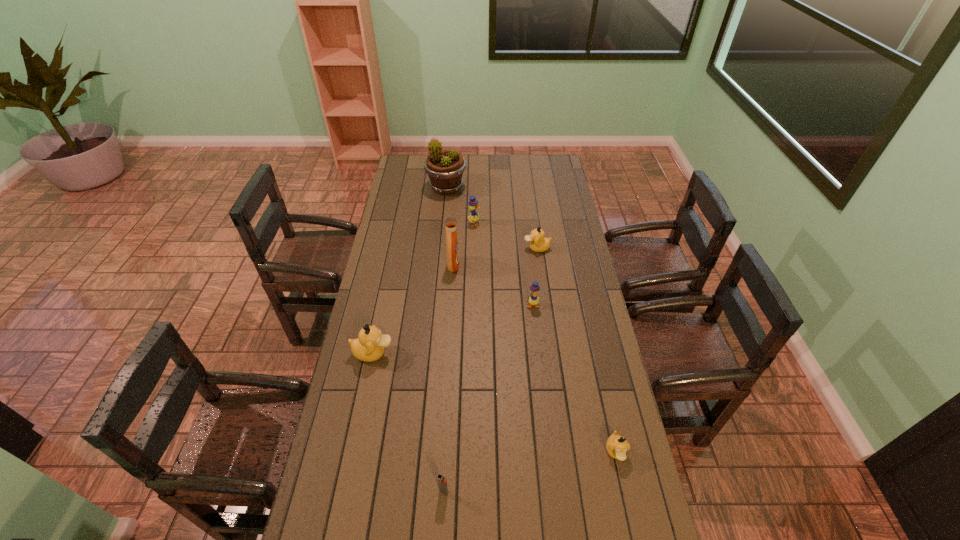
Where is `the fourth nearest object`? the fourth nearest object is located at coordinates (533, 300).

Where is `the third farthest duckling`? the third farthest duckling is located at coordinates (533, 300).

Locate an element on the screen. The height and width of the screenshot is (540, 960). igniter is located at coordinates (442, 482).

I want to click on the rightmost duckling, so click(x=617, y=446).

Where is `the rightmost object`? The height and width of the screenshot is (540, 960). the rightmost object is located at coordinates (617, 446).

Identify the location of vacant area situated on the left of the farthest object. (399, 188).

Find the location of `free space located 0.290m on the front-facing side of the fourth farthest object`. free space located 0.290m on the front-facing side of the fourth farthest object is located at coordinates (526, 266).

The width and height of the screenshot is (960, 540). What are the coordinates of `free region located 0.070m on the face of the second farthest tan duckling` in the screenshot? It's located at (414, 353).

At what (x,y) coordinates should I click in order to perform the action: click on free space located 0.160m on the face of the farther yellow duckling, where the monocle is placed. Please return your answer as a coordinate pair (x, y). Looking at the image, I should click on (514, 224).

At what (x,y) coordinates should I click in order to perform the action: click on vacant space located on the face of the second tan duckling from right to left. Please return your answer as a coordinate pair (x, y). This screenshot has width=960, height=540. Looking at the image, I should click on (501, 248).